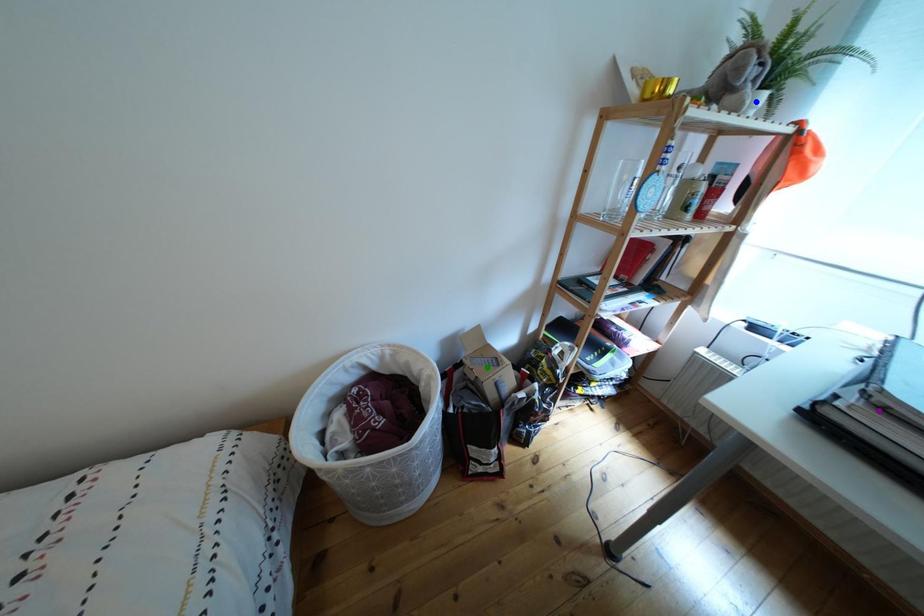
Looking at this image, order these from nearest to farthest:
- purple point
- blue point
- green point

purple point
blue point
green point